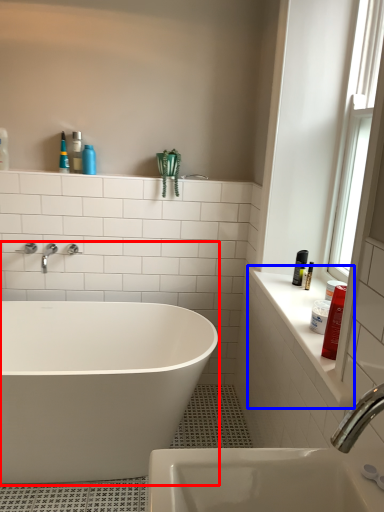
Question: Among these objects, which one is nearest to the camera, bathtub (highlighted by a red box) or counter top (highlighted by a blue box)?

Choices:
 (A) bathtub
 (B) counter top

Answer: (B)